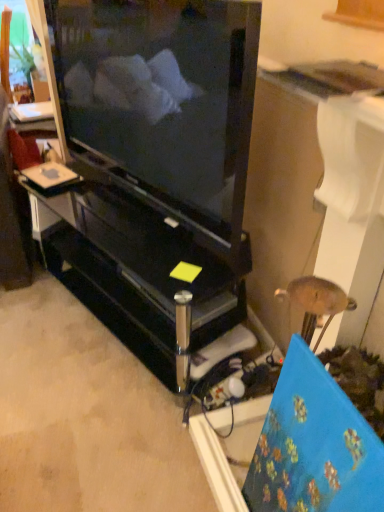
Question: In the image, is black glossy television at center positioned in front of or behind black glossy entertainment center at center?

Choices:
 (A) behind
 (B) front

Answer: (B)

Question: In terms of width, does black glossy television at center look wider or thinner when compared to black glossy entertainment center at center?

Choices:
 (A) wide
 (B) thin

Answer: (B)

Question: Does point (132, 2) appear closer or farther from the camera than point (84, 303)?

Choices:
 (A) farther
 (B) closer

Answer: (A)

Question: Considering the positions of black glossy entertainment center at center and black glossy television at center in the image, is black glossy entertainment center at center taller or shorter than black glossy television at center?

Choices:
 (A) tall
 (B) short

Answer: (B)

Question: Looking at their shapes, would you say black glossy entertainment center at center is wider or thinner than black glossy television at center?

Choices:
 (A) wide
 (B) thin

Answer: (A)

Question: From the image's perspective, is black glossy entertainment center at center positioned above or below black glossy television at center?

Choices:
 (A) above
 (B) below

Answer: (B)

Question: In the image, is black glossy entertainment center at center positioned in front of or behind black glossy television at center?

Choices:
 (A) front
 (B) behind

Answer: (B)